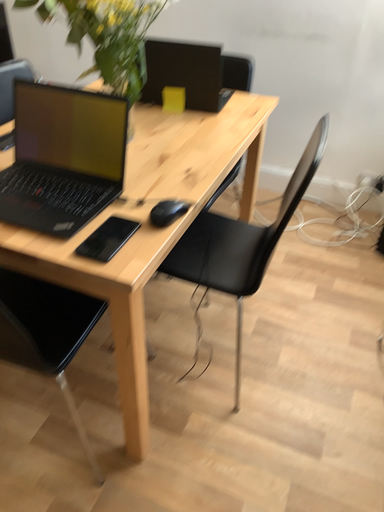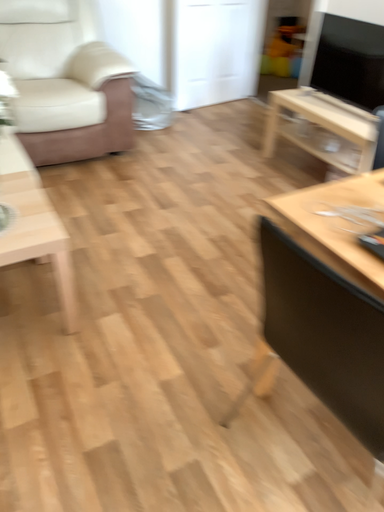
Question: Which way did the camera rotate in the video?

Choices:
 (A) rotated right
 (B) rotated left

Answer: (B)